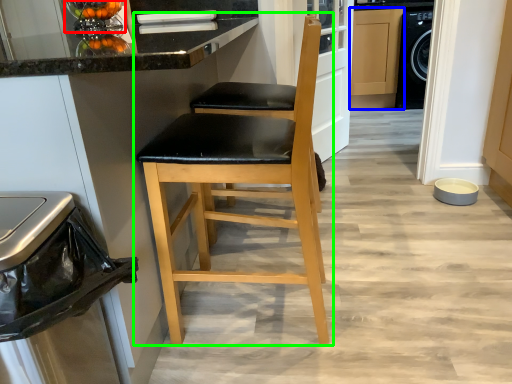
Question: Based on their relative distances, which object is nearer to appliance (highlighted by a red box)? Choose from cabinetry (highlighted by a blue box) and chair (highlighted by a green box).

Choices:
 (A) cabinetry
 (B) chair

Answer: (B)